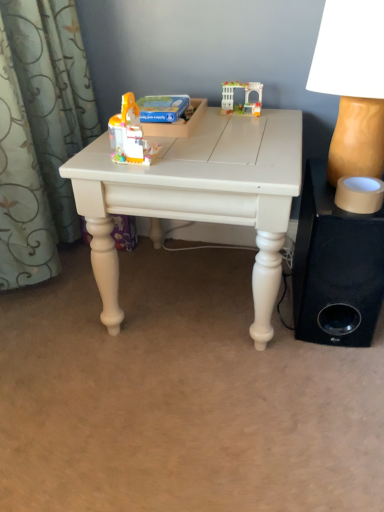
The image size is (384, 512). Find the location of `vacant space positioned to the left of white matte table at center`. vacant space positioned to the left of white matte table at center is located at coordinates (61, 313).